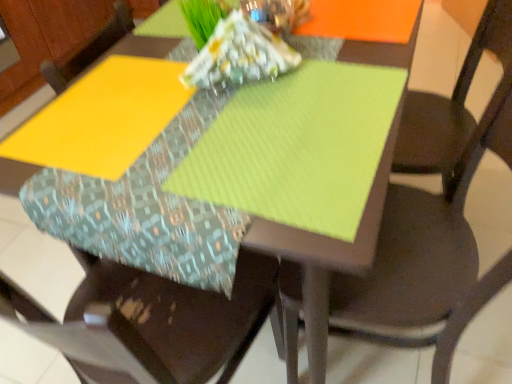
Question: Considering the relative sizes of matte brown chair at center, the 2th chair from the left, and fabric cushion at center, placed as the second chair when sorted from right to left, in the image provided, is matte brown chair at center, the 2th chair from the left, shorter than fabric cushion at center, placed as the second chair when sorted from right to left,?

Choices:
 (A) yes
 (B) no

Answer: (A)

Question: Is matte brown chair at center, which ranks as the 1th chair in right-to-left order, to the right of fabric cushion at center, the 1th chair in the left-to-right sequence, from the viewer's perspective?

Choices:
 (A) yes
 (B) no

Answer: (A)

Question: Is matte brown chair at center, the 2th chair from the left, placed right next to fabric cushion at center, placed as the second chair when sorted from right to left?

Choices:
 (A) yes
 (B) no

Answer: (B)

Question: From a real-world perspective, is matte brown chair at center, which ranks as the 1th chair in right-to-left order, physically above fabric cushion at center, the 1th chair in the left-to-right sequence?

Choices:
 (A) no
 (B) yes

Answer: (B)

Question: Is matte brown chair at center, the 2th chair from the left, oriented away from fabric cushion at center, placed as the second chair when sorted from right to left?

Choices:
 (A) yes
 (B) no

Answer: (B)

Question: Is fabric cushion at center, the 1th chair in the left-to-right sequence, a part of matte brown chair at center, the 2th chair from the left?

Choices:
 (A) yes
 (B) no

Answer: (B)

Question: Does fabric cushion at center, placed as the second chair when sorted from right to left, turn towards matte brown chair at center, which ranks as the 1th chair in right-to-left order?

Choices:
 (A) no
 (B) yes

Answer: (A)

Question: From a real-world perspective, does fabric cushion at center, the 1th chair in the left-to-right sequence, stand above matte brown chair at center, which ranks as the 1th chair in right-to-left order?

Choices:
 (A) no
 (B) yes

Answer: (A)

Question: Is the position of fabric cushion at center, the 1th chair in the left-to-right sequence, more distant than that of matte brown chair at center, which ranks as the 1th chair in right-to-left order?

Choices:
 (A) yes
 (B) no

Answer: (B)

Question: Is fabric cushion at center, placed as the second chair when sorted from right to left, turned away from matte brown chair at center, the 2th chair from the left?

Choices:
 (A) no
 (B) yes

Answer: (A)

Question: Considering the relative sizes of fabric cushion at center, the 1th chair in the left-to-right sequence, and matte brown chair at center, which ranks as the 1th chair in right-to-left order, in the image provided, is fabric cushion at center, the 1th chair in the left-to-right sequence, smaller than matte brown chair at center, which ranks as the 1th chair in right-to-left order,?

Choices:
 (A) yes
 (B) no

Answer: (B)

Question: Considering the relative positions of fabric cushion at center, the 1th chair in the left-to-right sequence, and matte brown chair at center, which ranks as the 1th chair in right-to-left order, in the image provided, is fabric cushion at center, the 1th chair in the left-to-right sequence, to the right of matte brown chair at center, which ranks as the 1th chair in right-to-left order, from the viewer's perspective?

Choices:
 (A) no
 (B) yes

Answer: (A)

Question: Considering the positions of matte brown chair at center, which ranks as the 1th chair in right-to-left order, and fabric cushion at center, placed as the second chair when sorted from right to left, in the image, is matte brown chair at center, which ranks as the 1th chair in right-to-left order, bigger or smaller than fabric cushion at center, placed as the second chair when sorted from right to left,?

Choices:
 (A) small
 (B) big

Answer: (A)